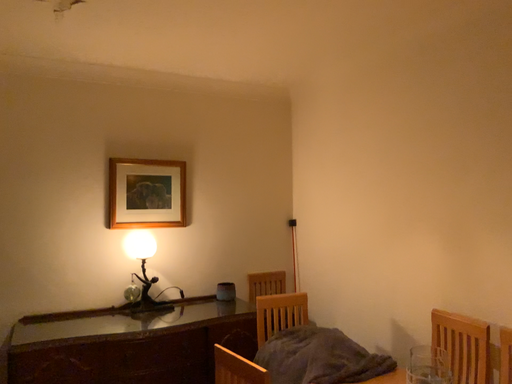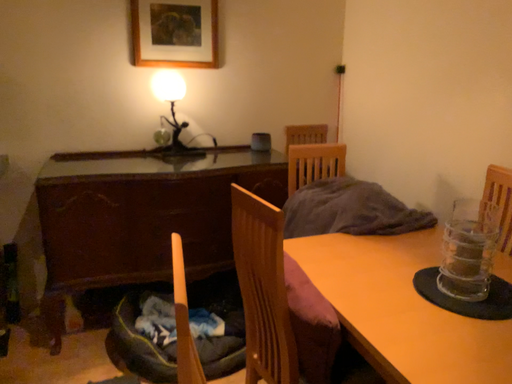
Question: How did the camera likely rotate when shooting the video?

Choices:
 (A) rotated downward
 (B) rotated upward

Answer: (A)